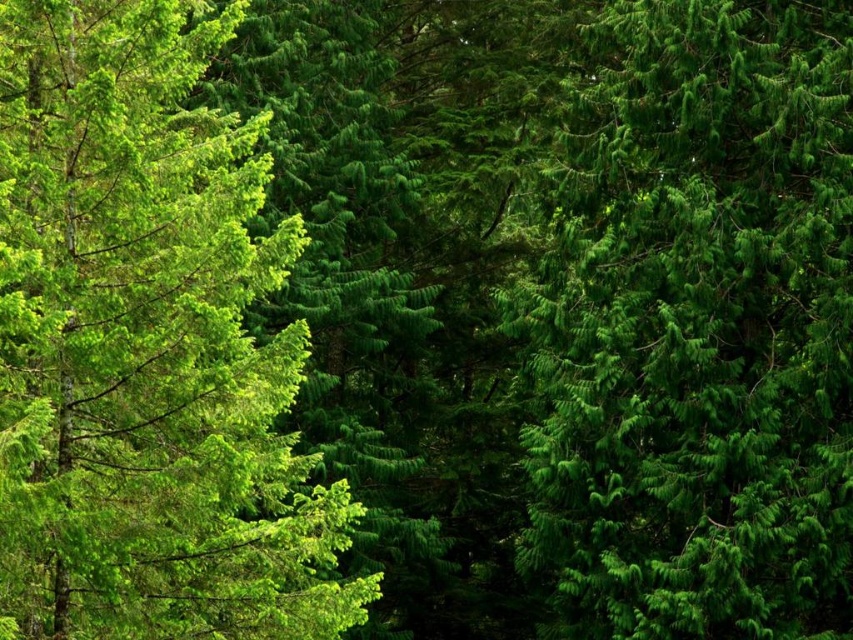
Question: Is green matte tree at center closer to camera compared to green matte tree at left?

Choices:
 (A) no
 (B) yes

Answer: (A)

Question: Is the position of green matte tree at center more distant than that of green matte tree at left?

Choices:
 (A) yes
 (B) no

Answer: (A)

Question: Can you confirm if green matte tree at center is positioned to the right of green matte tree at left?

Choices:
 (A) yes
 (B) no

Answer: (A)

Question: Which of the following is the farthest from the observer?

Choices:
 (A) green matte tree at center
 (B) green matte tree at left

Answer: (A)